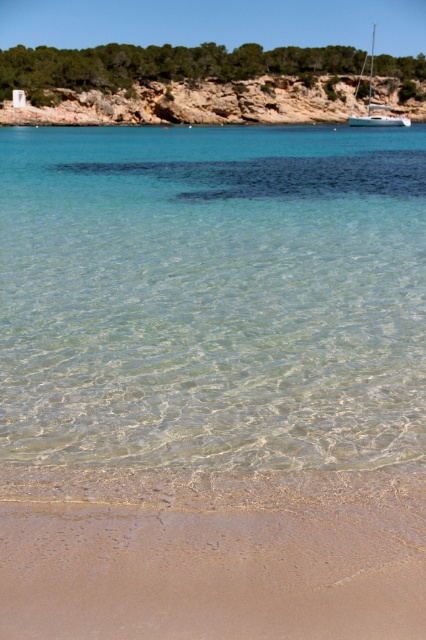
Is sandy at lower center thinner than white glossy sailboat at upper right?

Yes, sandy at lower center is thinner than white glossy sailboat at upper right.

Find the location of a particular element. The width and height of the screenshot is (426, 640). sandy at lower center is located at coordinates (212, 556).

You are a GUI agent. You are given a task and a screenshot of the screen. Output one action in this format:
    pyautogui.click(x=<x>, y=<y>)
    Task: Click on the sandy at lower center
    
    Given the screenshot: What is the action you would take?
    click(212, 556)

Between clear water at center and sandy at lower center, which one is positioned lower?

sandy at lower center

Between point (229, 129) and point (31, 588), which one is positioned behind?

The point (229, 129) is behind.

Image resolution: width=426 pixels, height=640 pixels. I want to click on clear water at center, so click(x=213, y=296).

Between point (45, 294) and point (388, 120), which one is positioned behind?

Positioned behind is point (388, 120).

Between clear water at center and white glossy sailboat at upper right, which one is positioned higher?

white glossy sailboat at upper right

You are a GUI agent. You are given a task and a screenshot of the screen. Output one action in this format:
    pyautogui.click(x=<x>, y=<y>)
    Task: Click on the clear water at center
    Image resolution: width=426 pixels, height=640 pixels.
    Given the screenshot: What is the action you would take?
    pyautogui.click(x=213, y=296)

At what (x,y) coordinates should I click in order to perform the action: click on clear water at center. Please return your answer as a coordinate pair (x, y). Looking at the image, I should click on (213, 296).